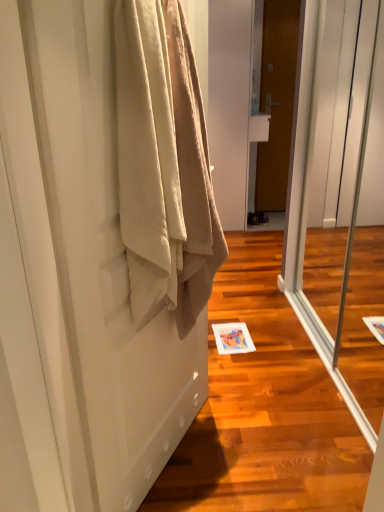
Where is `free area behind beige fabric door at left, the 2th door positioned from the top`? free area behind beige fabric door at left, the 2th door positioned from the top is located at coordinates (227, 391).